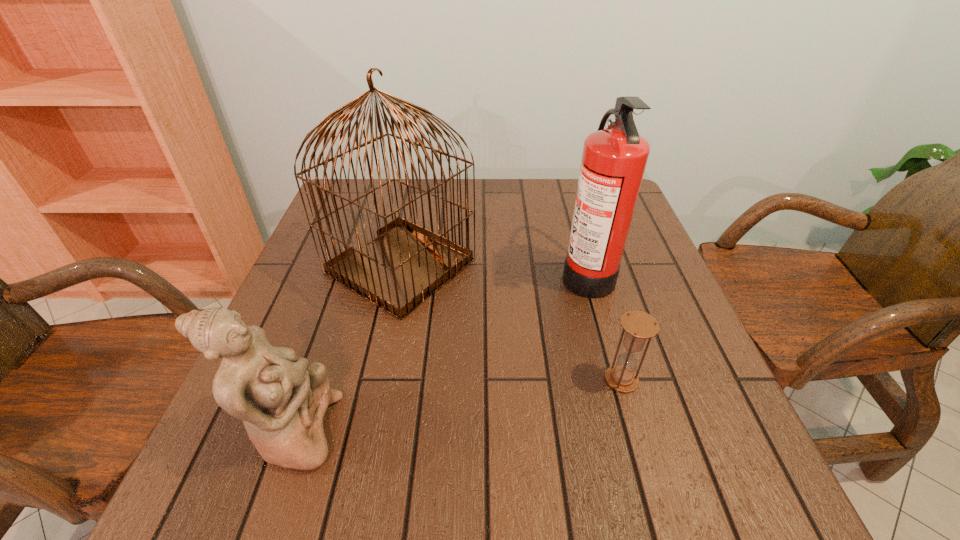
Locate an element on the screen. birdcage is located at coordinates (407, 263).

The image size is (960, 540). Identify the location of fire extinguisher. (614, 159).

Find the location of a particular element. The image size is (960, 540). the third tallest object is located at coordinates (282, 400).

Where is `hourglass`? This screenshot has width=960, height=540. hourglass is located at coordinates (638, 325).

Locate an element on the screen. This screenshot has height=540, width=960. vacant position located on the right of the birdcage is located at coordinates (570, 266).

Identify the location of free location located 0.240m on the front-facing side of the fire extinguisher. (461, 273).

The width and height of the screenshot is (960, 540). Identify the location of free space located 0.340m on the front-facing side of the fire extinguisher. (419, 273).

I want to click on free space located 0.200m on the front-facing side of the fire extinguisher, so click(477, 273).

Locate an element on the screen. The image size is (960, 540). free space located 0.290m on the front-facing side of the figurine is located at coordinates (509, 431).

What are the coordinates of `vacant space located on the back of the hourglass` in the screenshot? It's located at (582, 242).